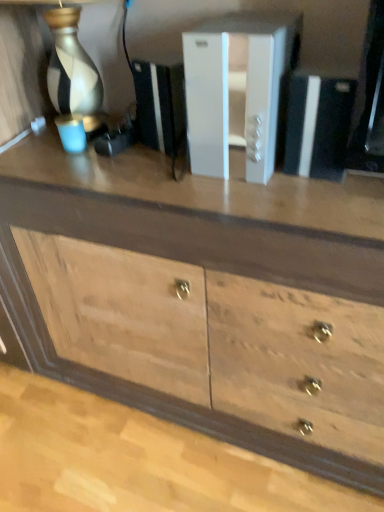
The image size is (384, 512). What do you see at coordinates (204, 298) in the screenshot?
I see `wooden chest of drawers at center` at bounding box center [204, 298].

This screenshot has width=384, height=512. Identify the location of wooden chest of drawers at center. (204, 298).

Measure the distance between point (254,66) and camera.

Point (254,66) is 29.92 inches away from camera.

Describe the element at coordinates (245, 90) in the screenshot. Image resolution: width=384 pixels, height=512 pixels. I see `white plastic file cabinet at center` at that location.

Locate an element on the screen. This screenshot has height=512, width=384. white plastic file cabinet at center is located at coordinates (245, 90).

The width and height of the screenshot is (384, 512). I want to click on wooden chest of drawers at center, so click(204, 298).

Between white plastic file cabinet at center and wooden chest of drawers at center, which one appears on the right side from the viewer's perspective?

white plastic file cabinet at center is more to the right.

Between white plastic file cabinet at center and wooden chest of drawers at center, which one is positioned behind?

white plastic file cabinet at center is further away from the camera.

Does point (256, 48) lie in front of point (376, 408)?

Yes, it is in front of point (376, 408).

From the image's perspective, is white plastic file cabinet at center on wooden chest of drawers at center?

Yes, from the image's perspective, white plastic file cabinet at center is above wooden chest of drawers at center.

From a real-world perspective, between white plastic file cabinet at center and wooden chest of drawers at center, who is vertically lower?

From a 3D spatial view, wooden chest of drawers at center is below.

Between white plastic file cabinet at center and wooden chest of drawers at center, which one has smaller width?

white plastic file cabinet at center.

Can you confirm if white plastic file cabinet at center is shorter than wooden chest of drawers at center?

Yes, white plastic file cabinet at center is shorter than wooden chest of drawers at center.

Between white plastic file cabinet at center and wooden chest of drawers at center, which one has smaller size?

With smaller size is white plastic file cabinet at center.

Looking at this image, is wooden chest of drawers at center surrounded by white plastic file cabinet at center?

That's incorrect, wooden chest of drawers at center is not inside white plastic file cabinet at center.

Are white plastic file cabinet at center and wooden chest of drawers at center far apart?

white plastic file cabinet at center is near wooden chest of drawers at center, not far away.

Is white plastic file cabinet at center positioned with its back to wooden chest of drawers at center?

No.

From the picture: What's the angular difference between white plastic file cabinet at center and wooden chest of drawers at center's facing directions?

0.504 degrees separate the facing orientations of white plastic file cabinet at center and wooden chest of drawers at center.

From the picture: How far apart are white plastic file cabinet at center and wooden chest of drawers at center?

white plastic file cabinet at center and wooden chest of drawers at center are 30.62 centimeters apart.

This screenshot has width=384, height=512. Find the location of `file cabinet that appears on the right of wooden chest of drawers at center`. file cabinet that appears on the right of wooden chest of drawers at center is located at coordinates (245, 90).

Which is more to the right, wooden chest of drawers at center or white plastic file cabinet at center?

Positioned to the right is white plastic file cabinet at center.

Which is in front, wooden chest of drawers at center or white plastic file cabinet at center?

wooden chest of drawers at center is in front.

Is point (286, 292) closer to camera compared to point (256, 63)?

No, it is behind (256, 63).

From the image's perspective, which is above, wooden chest of drawers at center or white plastic file cabinet at center?

white plastic file cabinet at center, from the image's perspective.

From a real-world perspective, between wooden chest of drawers at center and white plastic file cabinet at center, who is vertically higher?

white plastic file cabinet at center, from a real-world perspective.

Which of these two, wooden chest of drawers at center or white plastic file cabinet at center, is thinner?

Thinner between the two is white plastic file cabinet at center.

Considering the relative sizes of wooden chest of drawers at center and white plastic file cabinet at center in the image provided, is wooden chest of drawers at center taller than white plastic file cabinet at center?

Correct, wooden chest of drawers at center is much taller as white plastic file cabinet at center.

Between wooden chest of drawers at center and white plastic file cabinet at center, which one has larger size?

Bigger between the two is wooden chest of drawers at center.

Choose the correct answer: Is wooden chest of drawers at center inside white plastic file cabinet at center or outside it?

wooden chest of drawers at center is located beyond the bounds of white plastic file cabinet at center.

Are wooden chest of drawers at center and white plastic file cabinet at center making contact?

No.

Is wooden chest of drawers at center oriented towards white plastic file cabinet at center?

No.

How different are the orientations of wooden chest of drawers at center and white plastic file cabinet at center in degrees?

The facing directions of wooden chest of drawers at center and white plastic file cabinet at center are 0.504 degrees apart.

The image size is (384, 512). Identify the location of chest of drawers lying on the left of white plastic file cabinet at center. (x=204, y=298).

This screenshot has width=384, height=512. I want to click on file cabinet behind the wooden chest of drawers at center, so (245, 90).

In order to click on file cabinet that is above the wooden chest of drawers at center (from a real-world perspective) in this screenshot , I will do `click(245, 90)`.